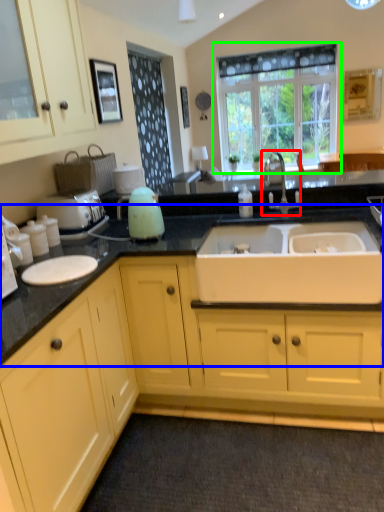
Question: Considering the real-world distances, which object is farthest from tap (highlighted by a red box)? countertop (highlighted by a blue box) or window (highlighted by a green box)?

Choices:
 (A) countertop
 (B) window

Answer: (B)